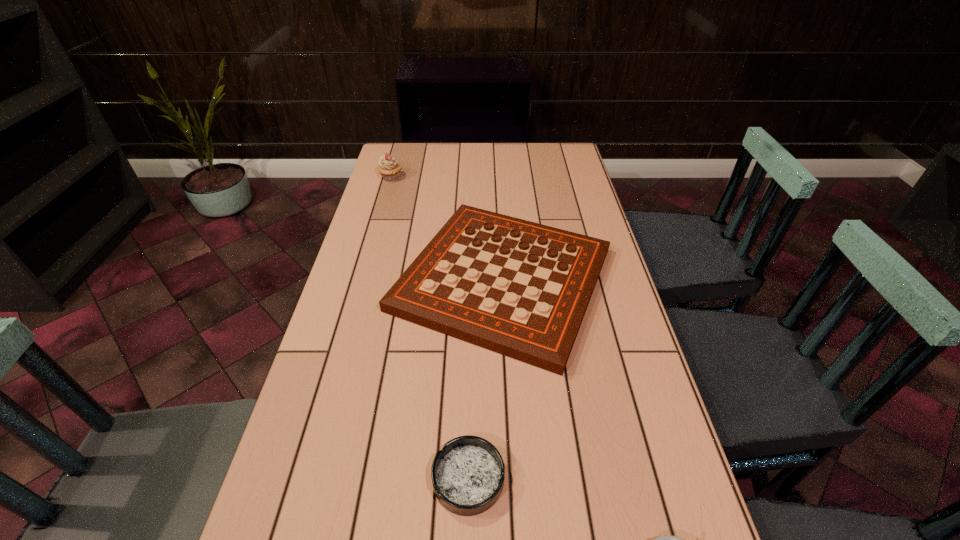
At what (x,y) coordinates should I click in order to perform the action: click on cupcake at the left edge. Please return your answer as a coordinate pair (x, y). This screenshot has width=960, height=540. Looking at the image, I should click on (389, 168).

Find the location of `gameboard positioned at the left edge`. gameboard positioned at the left edge is located at coordinates (521, 289).

At what (x,y) coordinates should I click in order to perform the action: click on object that is at the right edge. Please return your answer as a coordinate pair (x, y). Looking at the image, I should click on (521, 289).

Where is `object present at the far left corner`? object present at the far left corner is located at coordinates (389, 168).

Locate an element on the screen. Image resolution: width=960 pixels, height=540 pixels. free space at the far edge of the desktop is located at coordinates (499, 143).

This screenshot has height=540, width=960. Identify the location of vacant space at the left edge of the desktop. (389, 288).

Where is `vacant space at the right edge`? This screenshot has width=960, height=540. vacant space at the right edge is located at coordinates (594, 356).

Where is `vacant region at the far left corner of the desktop`? The height and width of the screenshot is (540, 960). vacant region at the far left corner of the desktop is located at coordinates (417, 170).

This screenshot has width=960, height=540. In the image, there is a desktop. Identify the location of vacant region at the far right corner. (563, 142).

This screenshot has height=540, width=960. I want to click on free space between the gameboard and the left ashtray, so click(486, 379).